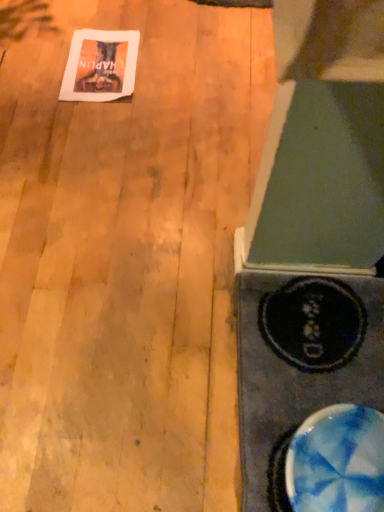
The width and height of the screenshot is (384, 512). I want to click on vacant area situated to the left side of white paper at upper left, so click(34, 71).